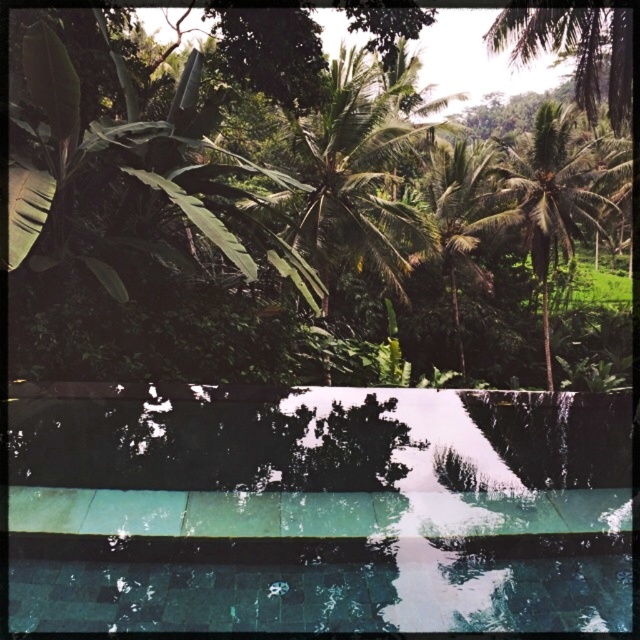
Question: Which is nearer to the green leafy tree at upper center?

Choices:
 (A) green leafy palm tree at center
 (B) green leafy palm tree at upper right
 (C) green tile swimming pool at center

Answer: (B)

Question: Does green tile swimming pool at center have a smaller size compared to green leafy tree at upper center?

Choices:
 (A) no
 (B) yes

Answer: (B)

Question: Which of the following is the farthest from the observer?

Choices:
 (A) green leafy palm tree at upper right
 (B) green leafy palm tree at center

Answer: (B)

Question: Is green leafy tree at upper center to the left of green leafy palm tree at center from the viewer's perspective?

Choices:
 (A) no
 (B) yes

Answer: (B)

Question: Is green leafy tree at upper center positioned at the back of green leafy palm tree at center?

Choices:
 (A) yes
 (B) no

Answer: (B)

Question: Among these points, which one is farthest from the camera?

Choices:
 (A) (477, 534)
 (B) (534, 205)
 (C) (484, 150)
 (D) (616, 97)

Answer: (C)